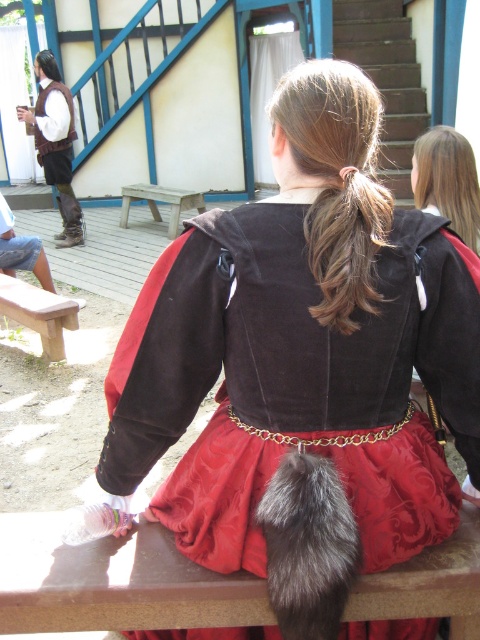
You are observing a person from behind in a historical costume. You notice two features on their head area. The first is the fuzzy fur ponytail at upper center, and the second is the shiny brown hair at upper right. Which of these two features is closer to you?

The fuzzy fur ponytail at upper center is closer to you since it is in front of the shiny brown hair at upper right.

You are planning to sit on the wooden park bench at center while wearing the velvet brown dress at center. Considering the bench is only wide enough for one person, will the dress fit comfortably without spilling over the sides?

The velvet brown dress at center has a lesser width compared to wooden park bench at center, so it will fit comfortably without spilling over the sides.

You are a photographer trying to capture a clear shot of the velvet brown dress at center and the wooden park bench at center. Since both are in the same frame, can you tell me which one is closer to the camera?

The velvet brown dress at center is in front of the wooden park bench at center, so it is closer to the camera.